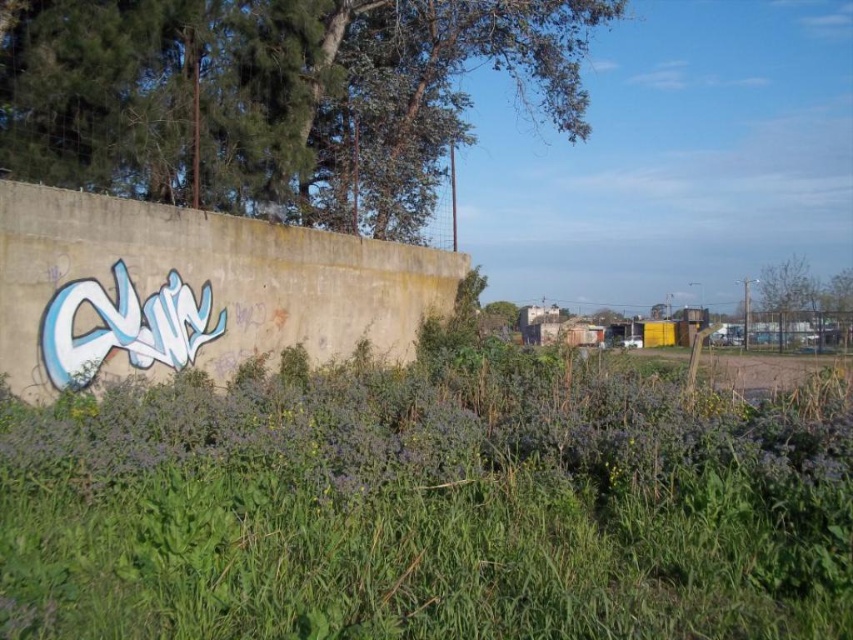
Question: Does green leafy tree at upper left have a lesser width compared to green leafy tree at upper right?

Choices:
 (A) yes
 (B) no

Answer: (B)

Question: Which object appears closest to the camera in this image?

Choices:
 (A) green leafy tree at upper left
 (B) green leafy tree at upper right
 (C) green leafy grass at center

Answer: (C)

Question: Which point appears farthest from the camera in this image?

Choices:
 (A) (305, 577)
 (B) (758, 308)

Answer: (B)

Question: Is green leafy tree at upper left below green leafy tree at upper right?

Choices:
 (A) yes
 (B) no

Answer: (B)

Question: Among these objects, which one is farthest from the camera?

Choices:
 (A) green leafy tree at upper right
 (B) green leafy grass at center

Answer: (A)

Question: Can you confirm if green leafy tree at upper left is bigger than green leafy tree at upper right?

Choices:
 (A) yes
 (B) no

Answer: (A)